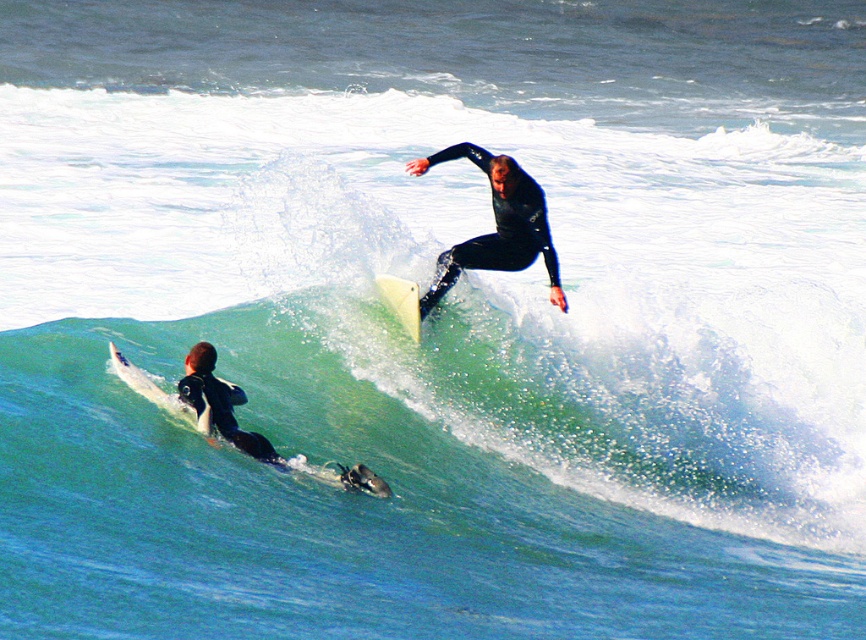
Does green rubber wave at center have a smaller size compared to black wetsuit surfer at lower left?

Correct, green rubber wave at center occupies less space than black wetsuit surfer at lower left.

Who is taller, green rubber wave at center or black wetsuit surfer at lower left?

black wetsuit surfer at lower left

Who is more distant from viewer, (x=771, y=493) or (x=228, y=396)?

Positioned behind is point (x=771, y=493).

Locate an element on the screen. The width and height of the screenshot is (866, 640). green rubber wave at center is located at coordinates tap(532, 396).

Between green rubber wave at center and black matte wetsuit at upper center, which one has more height?

black matte wetsuit at upper center

Does green rubber wave at center have a greater width compared to black matte wetsuit at upper center?

No, green rubber wave at center is not wider than black matte wetsuit at upper center.

In order to click on green rubber wave at center in this screenshot , I will do `click(532, 396)`.

Can you confirm if green rubber wave at center is positioned above white smooth surfboard at center?

Correct, green rubber wave at center is located above white smooth surfboard at center.

Between point (727, 419) and point (411, 310), which one is positioned behind?

The point (727, 419) is behind.

Between point (718, 515) and point (404, 326), which one is positioned in front?

Point (718, 515) is in front.

This screenshot has height=640, width=866. Identify the location of green rubber wave at center. (532, 396).